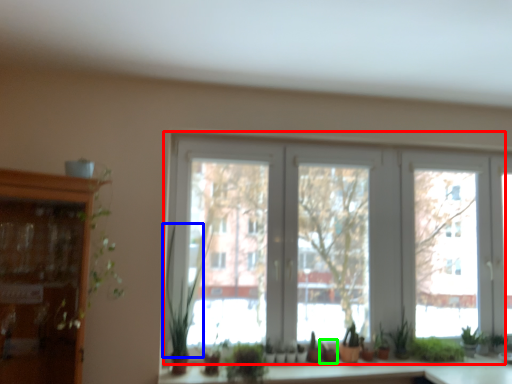
Question: Based on their relative distances, which object is nearer to window (highlighted by a red box)? Choose from plant (highlighted by a blue box) and plant (highlighted by a green box).

Choices:
 (A) plant
 (B) plant

Answer: (A)